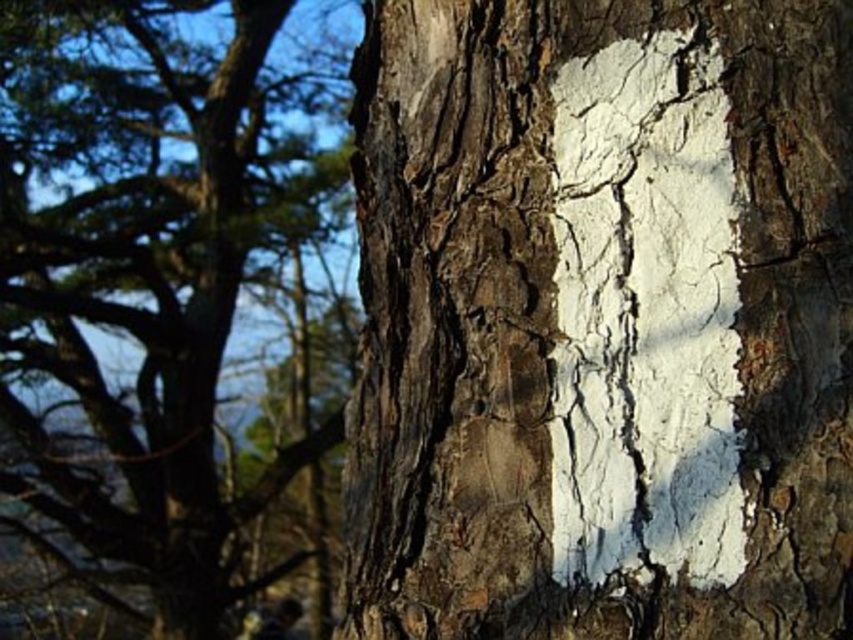
Question: Does white cracked bark at center appear over cracked bark tree trunk at center?

Choices:
 (A) no
 (B) yes

Answer: (A)

Question: Is white cracked bark at center above cracked bark tree trunk at center?

Choices:
 (A) no
 (B) yes

Answer: (A)

Question: Is white cracked bark at center behind cracked bark tree trunk at center?

Choices:
 (A) yes
 (B) no

Answer: (B)